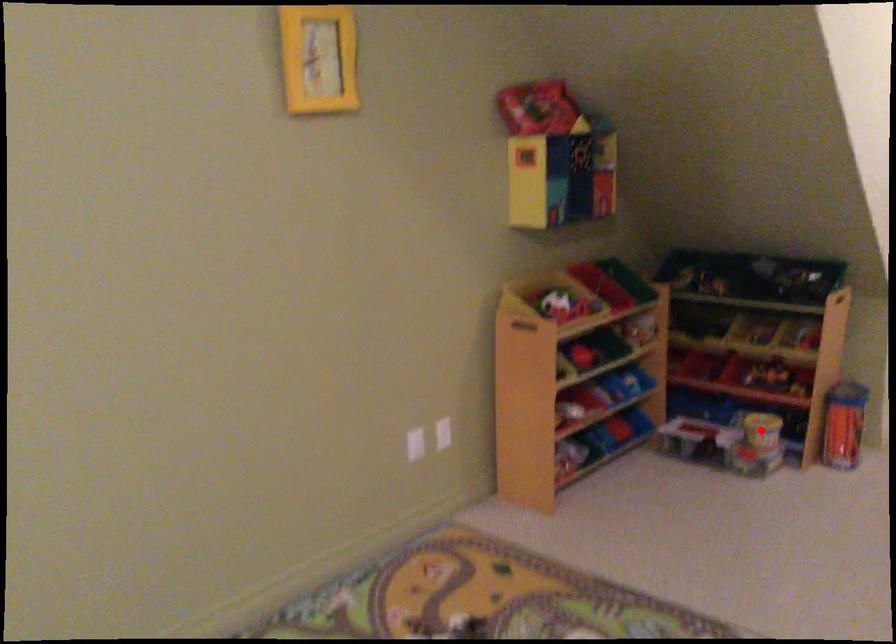
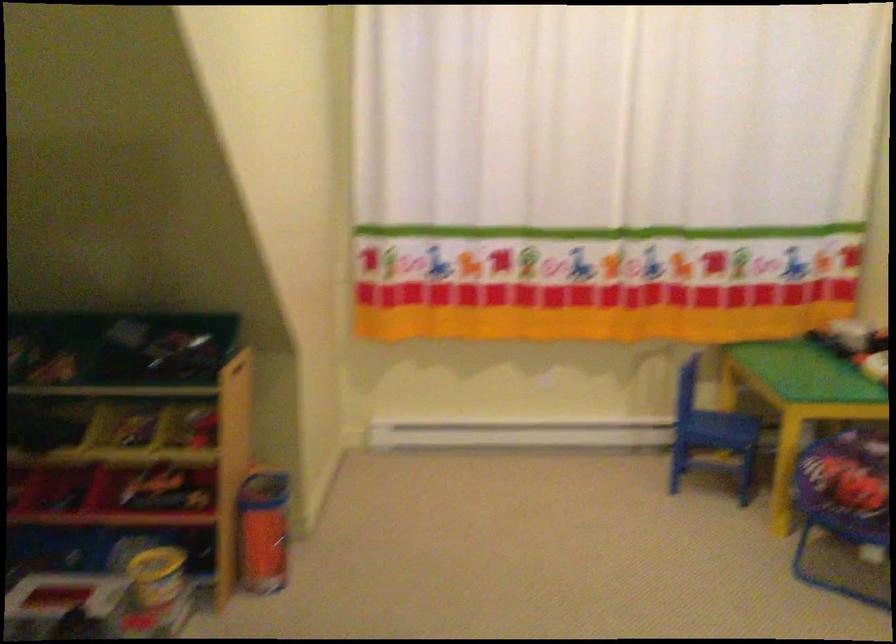
Question: I am providing you with two images of the same scene from different viewpoints. Image1 has a red point marked. In image2, the corresponding 3D location appears at what relative position? Reply with the corresponding letter.

Choices:
 (A) Closer
 (B) Farther

Answer: (A)